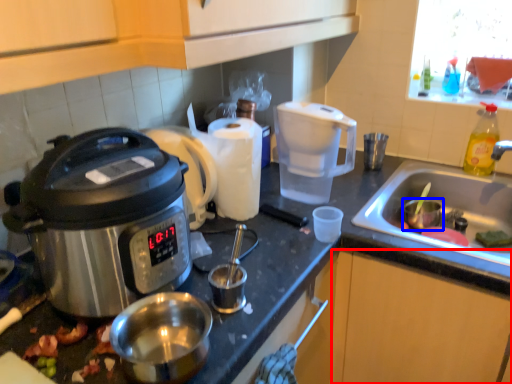
Question: Which object is further to the camera taking this photo, cabinetry (highlighted by a red box) or coffee cup (highlighted by a blue box)?

Choices:
 (A) cabinetry
 (B) coffee cup

Answer: (B)